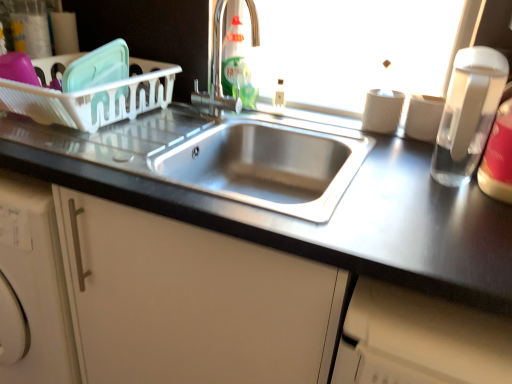
Question: From a real-world perspective, is satin nickel faucet at upper center physically located above or below clear plastic bottle at right, the first bottle viewed from the right?

Choices:
 (A) below
 (B) above

Answer: (B)

Question: Considering the positions of satin nickel faucet at upper center and clear plastic bottle at right, which appears as the 3th bottle when viewed from the top, in the image, is satin nickel faucet at upper center taller or shorter than clear plastic bottle at right, which appears as the 3th bottle when viewed from the top,?

Choices:
 (A) short
 (B) tall

Answer: (B)

Question: Estimate the real-world distances between objects in this image. Which object is farther from the satin finish cabinet at center?

Choices:
 (A) translucent plastic bottle at upper center, acting as the 3th bottle starting from the bottom
 (B) translucent green liquid at sink center, arranged as the second bottle when ordered from the bottom
 (C) stainless steel sink at center
 (D) clear glass water bottle at right
 (E) satin nickel faucet at upper center

Answer: (A)

Question: Based on their relative distances, which object is farther from the translucent green liquid at sink center, positioned as the 3th bottle in front-to-back order?

Choices:
 (A) clear plastic bottle at right, which is the 3th bottle from back to front
 (B) translucent plastic bottle at upper center, the 2th bottle positioned from the back
 (C) satin nickel faucet at upper center
 (D) clear glass water bottle at right
 (E) satin finish cabinet at center

Answer: (A)